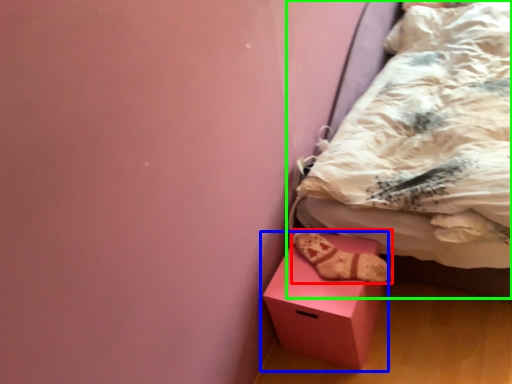
Question: Estimate the real-world distances between objects in this image. Which object is closer to footwear (highlighted by a red box), box (highlighted by a blue box) or bed (highlighted by a green box)?

Choices:
 (A) box
 (B) bed

Answer: (A)